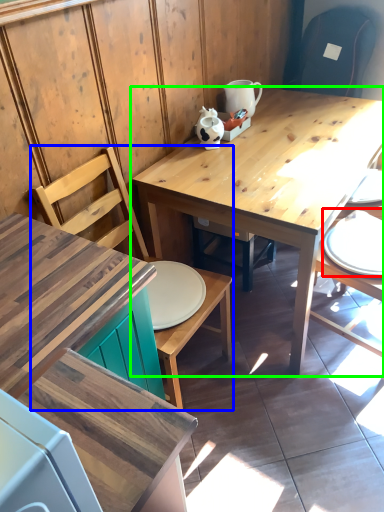
Question: Based on their relative distances, which object is nearer to tableware (highlighted by a red box)? Choose from chair (highlighted by a blue box) and table (highlighted by a green box).

Choices:
 (A) chair
 (B) table

Answer: (B)